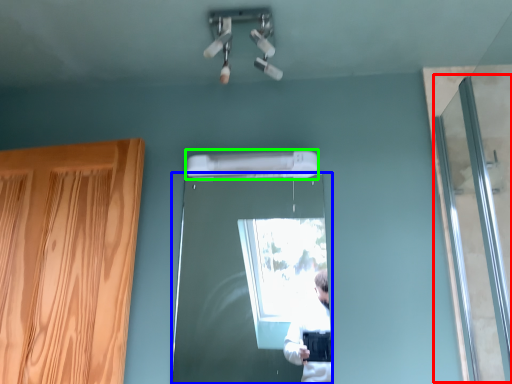
Question: Which object is the farthest from screen door (highlighted by a red box)? Choose among these: door (highlighted by a blue box) or air conditioner (highlighted by a green box).

Choices:
 (A) door
 (B) air conditioner

Answer: (A)